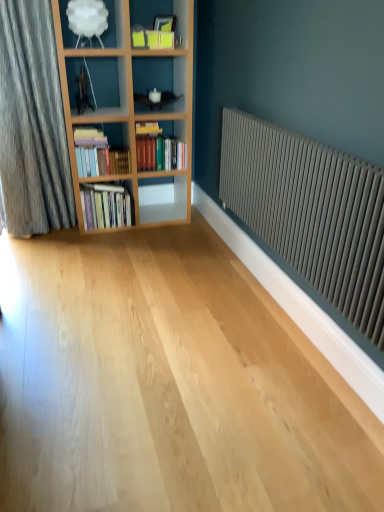
Question: From the image's perspective, does hardcover books at center, the first book positioned from the top, appear lower than white glossy shelf at center, the first shelf in the back-to-front sequence?

Choices:
 (A) yes
 (B) no

Answer: (B)

Question: Is hardcover books at center, the third book when ordered from bottom to top, oriented towards white glossy shelf at center, the 2th shelf viewed from the top?

Choices:
 (A) no
 (B) yes

Answer: (A)

Question: Is hardcover books at center, the first book positioned from the top, thinner than white glossy shelf at center, which appears as the 1th shelf when ordered from the bottom?

Choices:
 (A) yes
 (B) no

Answer: (B)

Question: From the image's perspective, is hardcover books at center, the third book when ordered from bottom to top, above white glossy shelf at center, the first shelf in the back-to-front sequence?

Choices:
 (A) yes
 (B) no

Answer: (A)

Question: Can you confirm if hardcover books at center, the third book when ordered from bottom to top, is bigger than white glossy shelf at center, the first shelf in the back-to-front sequence?

Choices:
 (A) yes
 (B) no

Answer: (A)

Question: Does hardcover books at center, the first book positioned from the top, come behind white glossy shelf at center, the first shelf in the back-to-front sequence?

Choices:
 (A) no
 (B) yes

Answer: (A)

Question: Does hardcover books at left, which is the 3th book in top-to-bottom order, come in front of hardcover books at left, the 2th book from the bottom?

Choices:
 (A) no
 (B) yes

Answer: (A)

Question: Is the position of hardcover books at left, marked as the 1th book in a bottom-to-top arrangement, more distant than that of hardcover books at left, placed as the second book when sorted from top to bottom?

Choices:
 (A) yes
 (B) no

Answer: (A)

Question: Can you confirm if hardcover books at left, marked as the 1th book in a bottom-to-top arrangement, is shorter than hardcover books at left, placed as the second book when sorted from top to bottom?

Choices:
 (A) no
 (B) yes

Answer: (A)

Question: Is hardcover books at left, marked as the 1th book in a bottom-to-top arrangement, looking in the opposite direction of hardcover books at left, placed as the second book when sorted from top to bottom?

Choices:
 (A) yes
 (B) no

Answer: (B)

Question: Is hardcover books at left, marked as the 1th book in a bottom-to-top arrangement, bigger than hardcover books at left, the 2th book from the bottom?

Choices:
 (A) yes
 (B) no

Answer: (A)

Question: Can you confirm if hardcover books at left, marked as the 1th book in a bottom-to-top arrangement, is thinner than hardcover books at left, the 2th book from the bottom?

Choices:
 (A) yes
 (B) no

Answer: (B)

Question: From a real-world perspective, is hardcover books at left, which is the 3th book in top-to-bottom order, physically below matte gray radiator at right?

Choices:
 (A) yes
 (B) no

Answer: (A)